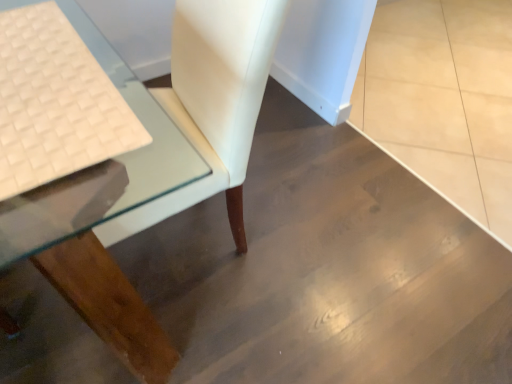
Where is `unoccupied region to the right of clear glass table at lower left`? unoccupied region to the right of clear glass table at lower left is located at coordinates (311, 253).